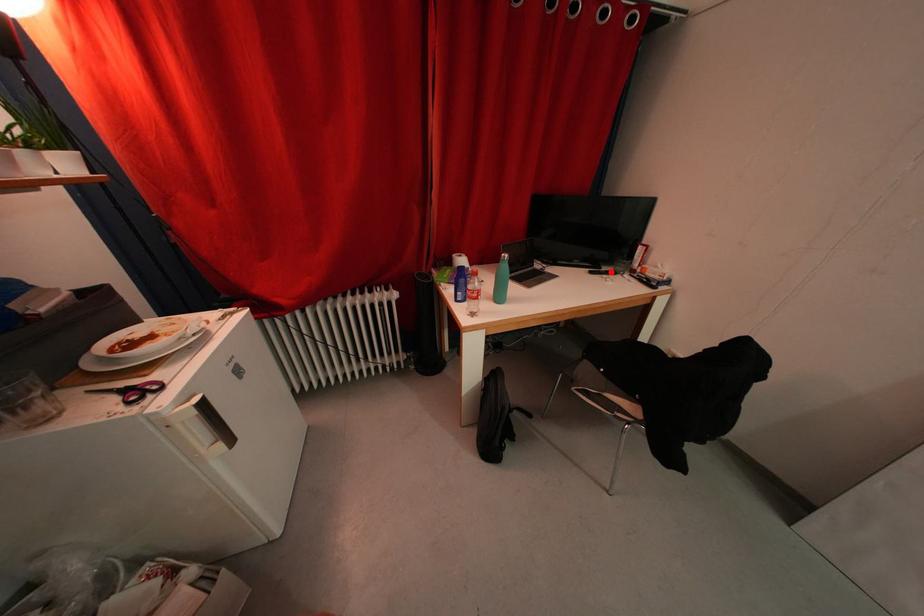
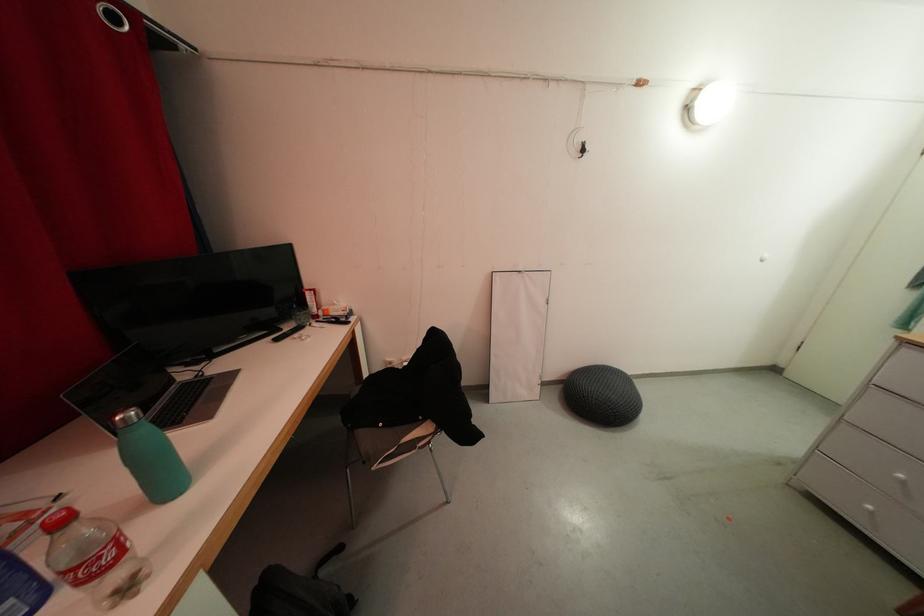
In the second image, find the point that corresponds to the highlighted location in the first image.

(293, 331)